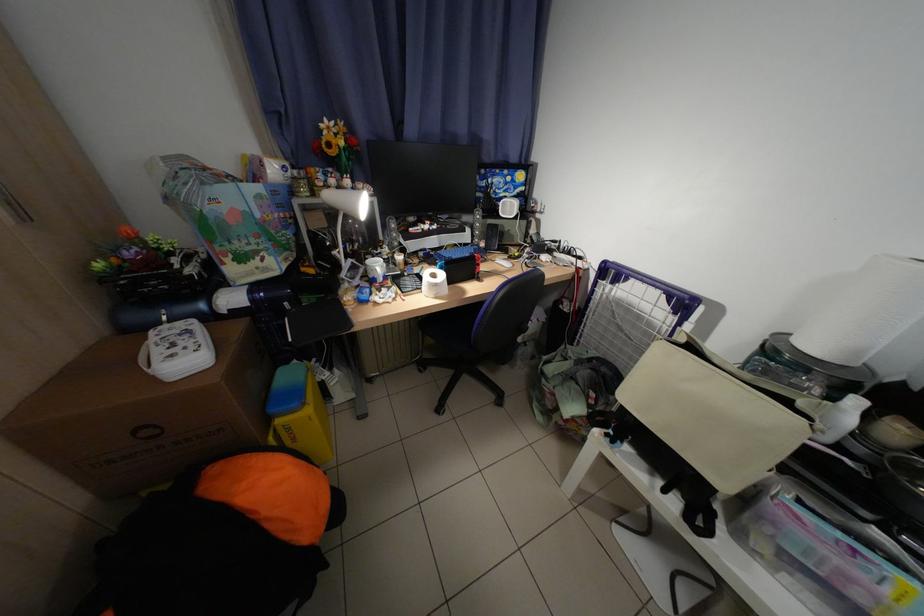
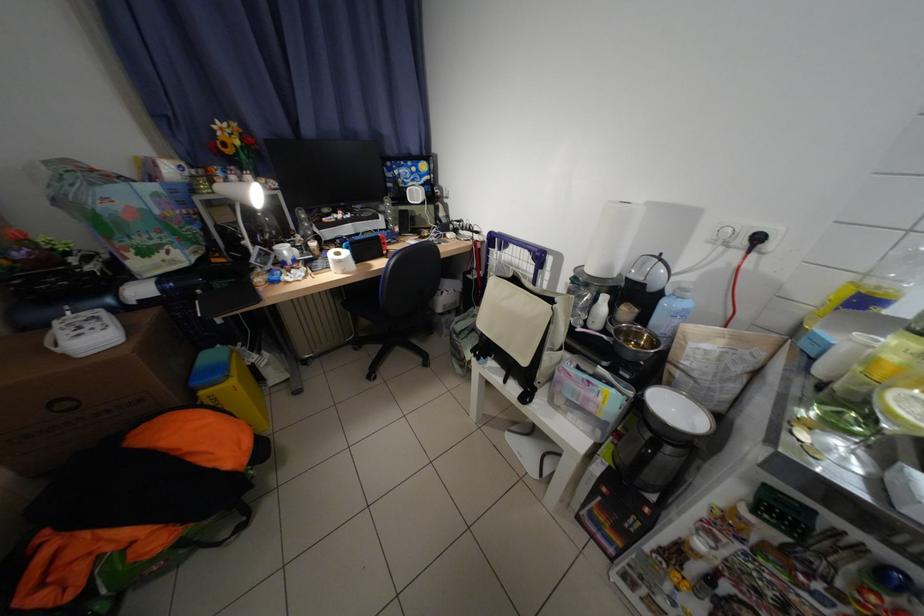
The images are taken continuously from a first-person perspective. In which direction are you moving?

The cameraman walked toward right, backward.